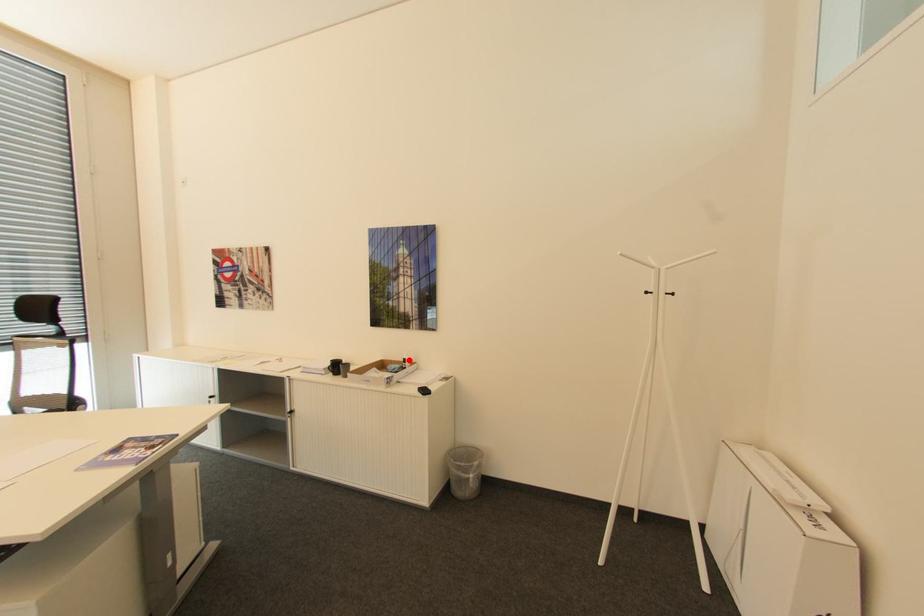
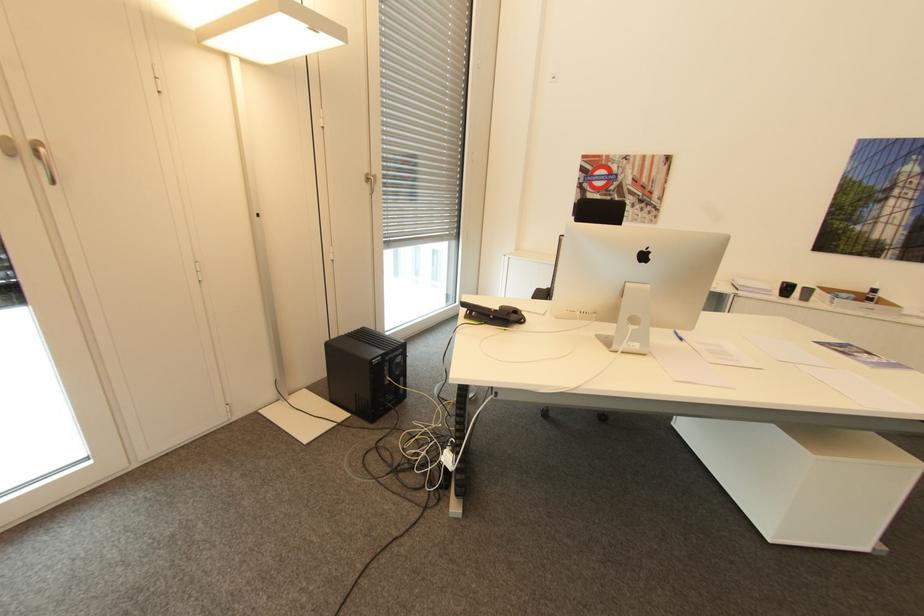
In the second image, find the point that corresponds to the highlighted location in the first image.

(879, 290)